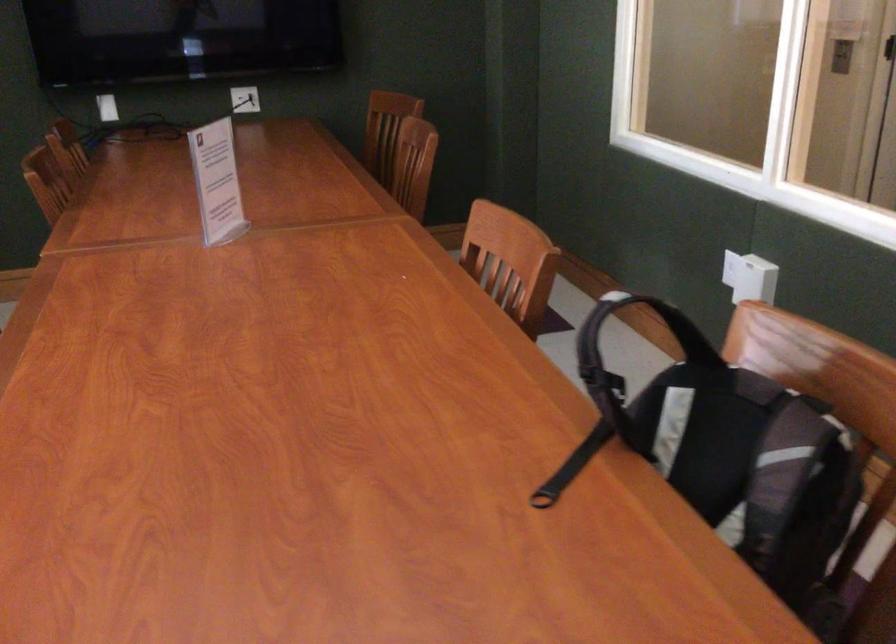
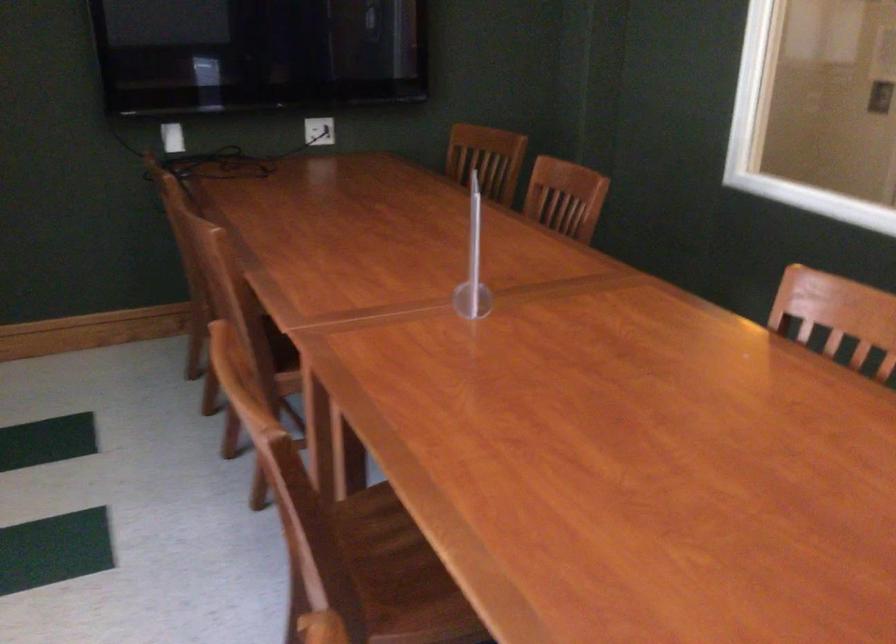
Where in the second image is the point corresponding to pixel 398 122 from the first image?

(487, 158)